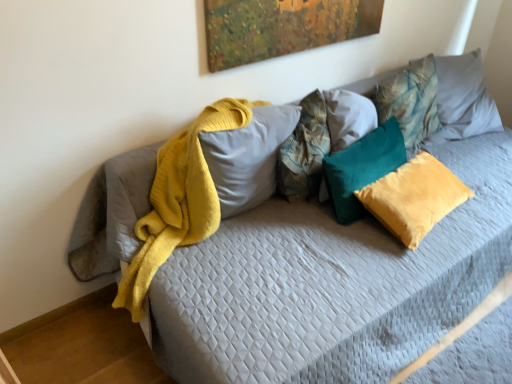
Measure the distance between teal velvet pillow at center, the third pillow positioned from the left, and camera.

The distance of teal velvet pillow at center, the third pillow positioned from the left, from camera is 1.55 meters.

Image resolution: width=512 pixels, height=384 pixels. Describe the element at coordinates (414, 197) in the screenshot. I see `teal velvet pillow at center, which is the 2th pillow in right-to-left order` at that location.

Image resolution: width=512 pixels, height=384 pixels. In order to click on textured teal pillow at center, which is counted as the fourth pillow, starting from the right in this screenshot , I will do tap(304, 151).

What are the coordinates of `teal velvet pillow at center, the third pillow positioned from the left` in the screenshot? It's located at (362, 168).

The height and width of the screenshot is (384, 512). I want to click on the 4th pillow in front when counting from the teal velvet pillow at upper right, positioned as the 1th pillow in right-to-left order, so click(248, 157).

Considering the sizes of objects soft yellow fabric pillow at center, which ranks as the fifth pillow in right-to-left order, and teal velvet pillow at upper right, positioned as the 1th pillow in right-to-left order, in the image provided, who is wider, soft yellow fabric pillow at center, which ranks as the fifth pillow in right-to-left order, or teal velvet pillow at upper right, positioned as the 1th pillow in right-to-left order,?

soft yellow fabric pillow at center, which ranks as the fifth pillow in right-to-left order, is wider.

From the image's perspective, who appears lower, soft yellow fabric pillow at center, the 1th pillow from the left, or teal velvet pillow at upper right, positioned as the 1th pillow in right-to-left order?

soft yellow fabric pillow at center, the 1th pillow from the left, from the image's perspective.

Is soft yellow fabric pillow at center, which ranks as the fifth pillow in right-to-left order, surrounding teal velvet pillow at upper right, marked as the 5th pillow in a left-to-right arrangement?

No, teal velvet pillow at upper right, marked as the 5th pillow in a left-to-right arrangement, is located outside of soft yellow fabric pillow at center, which ranks as the fifth pillow in right-to-left order.

Is textured teal pillow at center, which is counted as the fourth pillow, starting from the right, positioned far away from teal velvet pillow at center, acting as the 3th pillow starting from the right?

They are positioned close to each other.

Between textured teal pillow at center, which is counted as the fourth pillow, starting from the right, and teal velvet pillow at center, the third pillow positioned from the left, which one has more height?

textured teal pillow at center, which is counted as the fourth pillow, starting from the right.

The image size is (512, 384). Identify the location of pillow that is the 2nd one when counting downward from the textured teal pillow at center, the 2th pillow viewed from the left (from the image's perspective). (362, 168).

Is textured teal pillow at center, which is counted as the fourth pillow, starting from the right, located outside teal velvet pillow at center, the third pillow positioned from the left?

Yes, textured teal pillow at center, which is counted as the fourth pillow, starting from the right, is not within teal velvet pillow at center, the third pillow positioned from the left.

From the image's perspective, starting from the teal velvet pillow at center, which is the 2th pillow in right-to-left order, which pillow is the 1st one above? Please provide its 2D coordinates.

[(362, 168)]

Does teal velvet pillow at center, the third pillow positioned from the left, appear on the right side of teal velvet pillow at center, which is the 2th pillow in right-to-left order?

Incorrect, teal velvet pillow at center, the third pillow positioned from the left, is not on the right side of teal velvet pillow at center, which is the 2th pillow in right-to-left order.

Consider the image. Which object is more forward, teal velvet pillow at center, acting as the 3th pillow starting from the right, or teal velvet pillow at center, which is the fourth pillow in left-to-right order?

teal velvet pillow at center, which is the fourth pillow in left-to-right order.

Is teal velvet pillow at center, the third pillow positioned from the left, inside or outside of teal velvet pillow at center, which is the 2th pillow in right-to-left order?

teal velvet pillow at center, the third pillow positioned from the left, is located beyond the bounds of teal velvet pillow at center, which is the 2th pillow in right-to-left order.

Which of these two, teal velvet pillow at upper right, positioned as the 1th pillow in right-to-left order, or soft yellow fabric pillow at center, which ranks as the fifth pillow in right-to-left order, is bigger?

soft yellow fabric pillow at center, which ranks as the fifth pillow in right-to-left order, is bigger.

Considering the relative sizes of teal velvet pillow at upper right, marked as the 5th pillow in a left-to-right arrangement, and soft yellow fabric pillow at center, which ranks as the fifth pillow in right-to-left order, in the image provided, is teal velvet pillow at upper right, marked as the 5th pillow in a left-to-right arrangement, wider than soft yellow fabric pillow at center, which ranks as the fifth pillow in right-to-left order,?

In fact, teal velvet pillow at upper right, marked as the 5th pillow in a left-to-right arrangement, might be narrower than soft yellow fabric pillow at center, which ranks as the fifth pillow in right-to-left order.

Is teal velvet pillow at upper right, marked as the 5th pillow in a left-to-right arrangement, placed right next to soft yellow fabric pillow at center, the 1th pillow from the left?

No, teal velvet pillow at upper right, marked as the 5th pillow in a left-to-right arrangement, is not with soft yellow fabric pillow at center, the 1th pillow from the left.

From a real-world perspective, between teal velvet pillow at center, which is the fourth pillow in left-to-right order, and teal velvet pillow at upper right, marked as the 5th pillow in a left-to-right arrangement, who is vertically higher?

teal velvet pillow at upper right, marked as the 5th pillow in a left-to-right arrangement, is physically above.

Is teal velvet pillow at center, which is the 2th pillow in right-to-left order, positioned with its back to teal velvet pillow at upper right, positioned as the 1th pillow in right-to-left order?

No, teal velvet pillow at center, which is the 2th pillow in right-to-left order, is not facing the opposite direction of teal velvet pillow at upper right, positioned as the 1th pillow in right-to-left order.

Between teal velvet pillow at center, which is the fourth pillow in left-to-right order, and teal velvet pillow at upper right, marked as the 5th pillow in a left-to-right arrangement, which one has smaller size?

With smaller size is teal velvet pillow at center, which is the fourth pillow in left-to-right order.

Which is correct: teal velvet pillow at center, which is the fourth pillow in left-to-right order, is inside textured teal pillow at center, which is counted as the fourth pillow, starting from the right, or outside of it?

teal velvet pillow at center, which is the fourth pillow in left-to-right order, exists outside the volume of textured teal pillow at center, which is counted as the fourth pillow, starting from the right.

Is teal velvet pillow at center, which is the fourth pillow in left-to-right order, next to textured teal pillow at center, which is counted as the fourth pillow, starting from the right?

teal velvet pillow at center, which is the fourth pillow in left-to-right order, is not next to textured teal pillow at center, which is counted as the fourth pillow, starting from the right, and they're not touching.

Which is behind, teal velvet pillow at center, which is the 2th pillow in right-to-left order, or textured teal pillow at center, which is counted as the fourth pillow, starting from the right?

textured teal pillow at center, which is counted as the fourth pillow, starting from the right, is behind.

Where is `the 2nd pillow behind when counting from the textured teal pillow at center, the 2th pillow viewed from the left`? the 2nd pillow behind when counting from the textured teal pillow at center, the 2th pillow viewed from the left is located at coordinates (410, 100).

Measure the distance between textured teal pillow at center, the 2th pillow viewed from the left, and teal velvet pillow at upper right, marked as the 5th pillow in a left-to-right arrangement.

The distance of textured teal pillow at center, the 2th pillow viewed from the left, from teal velvet pillow at upper right, marked as the 5th pillow in a left-to-right arrangement, is 20.85 inches.

Between point (305, 178) and point (435, 82), which one is positioned in front?

Point (305, 178)

From a real-world perspective, is textured teal pillow at center, the 2th pillow viewed from the left, above or below teal velvet pillow at upper right, marked as the 5th pillow in a left-to-right arrangement?

In terms of real-world spatial position, textured teal pillow at center, the 2th pillow viewed from the left, is above teal velvet pillow at upper right, marked as the 5th pillow in a left-to-right arrangement.

Find the location of a particular element. pillow that is the 2nd one when counting upward from the soft yellow fabric pillow at center, which ranks as the fifth pillow in right-to-left order (from the image's perspective) is located at coordinates (410, 100).

In order to click on pillow that is the 1st one when counting forward from the teal velvet pillow at center, acting as the 3th pillow starting from the right in this screenshot , I will do `click(304, 151)`.

Considering their positions, is teal velvet pillow at upper right, positioned as the 1th pillow in right-to-left order, positioned closer to soft yellow fabric pillow at center, the 1th pillow from the left, than teal velvet pillow at center, which is the fourth pillow in left-to-right order?

teal velvet pillow at center, which is the fourth pillow in left-to-right order.

Looking at the image, which one is located closer to soft yellow fabric pillow at center, the 1th pillow from the left, teal velvet pillow at center, the third pillow positioned from the left, or teal velvet pillow at upper right, marked as the 5th pillow in a left-to-right arrangement?

Among the two, teal velvet pillow at center, the third pillow positioned from the left, is located nearer to soft yellow fabric pillow at center, the 1th pillow from the left.

Looking at the image, which one is located further to teal velvet pillow at center, the third pillow positioned from the left, soft yellow fabric pillow at center, the 1th pillow from the left, or textured teal pillow at center, which is counted as the fourth pillow, starting from the right?

Based on the image, soft yellow fabric pillow at center, the 1th pillow from the left, appears to be further to teal velvet pillow at center, the third pillow positioned from the left.

Looking at the image, which one is located closer to teal velvet pillow at center, acting as the 3th pillow starting from the right, soft yellow fabric pillow at center, the 1th pillow from the left, or teal velvet pillow at center, which is the 2th pillow in right-to-left order?

Based on the image, teal velvet pillow at center, which is the 2th pillow in right-to-left order, appears to be nearer to teal velvet pillow at center, acting as the 3th pillow starting from the right.

Which object lies further to the anchor point textured teal pillow at center, which is counted as the fourth pillow, starting from the right, soft yellow fabric pillow at center, the 1th pillow from the left, or teal velvet pillow at center, which is the 2th pillow in right-to-left order?

Among the two, teal velvet pillow at center, which is the 2th pillow in right-to-left order, is located further to textured teal pillow at center, which is counted as the fourth pillow, starting from the right.

Which object lies further to the anchor point teal velvet pillow at center, which is the fourth pillow in left-to-right order, teal velvet pillow at center, the third pillow positioned from the left, or soft yellow fabric pillow at center, which ranks as the fifth pillow in right-to-left order?

→ soft yellow fabric pillow at center, which ranks as the fifth pillow in right-to-left order, lies further to teal velvet pillow at center, which is the fourth pillow in left-to-right order, than the other object.

Based on their spatial positions, is teal velvet pillow at center, which is the 2th pillow in right-to-left order, or soft yellow fabric pillow at center, the 1th pillow from the left, closer to teal velvet pillow at upper right, marked as the 5th pillow in a left-to-right arrangement?

teal velvet pillow at center, which is the 2th pillow in right-to-left order, is positioned closer to the anchor teal velvet pillow at upper right, marked as the 5th pillow in a left-to-right arrangement.

Looking at the image, which one is located closer to teal velvet pillow at center, acting as the 3th pillow starting from the right, soft yellow fabric pillow at center, the 1th pillow from the left, or teal velvet pillow at upper right, positioned as the 1th pillow in right-to-left order?

teal velvet pillow at upper right, positioned as the 1th pillow in right-to-left order.

This screenshot has height=384, width=512. What are the coordinates of `pillow situated between soft yellow fabric pillow at center, which ranks as the fifth pillow in right-to-left order, and teal velvet pillow at center, the third pillow positioned from the left, from left to right` in the screenshot? It's located at (304, 151).

At what (x,y) coordinates should I click in order to perform the action: click on pillow between textured teal pillow at center, which is counted as the fourth pillow, starting from the right, and teal velvet pillow at center, which is the 2th pillow in right-to-left order, from left to right. Please return your answer as a coordinate pair (x, y). The image size is (512, 384). Looking at the image, I should click on (362, 168).